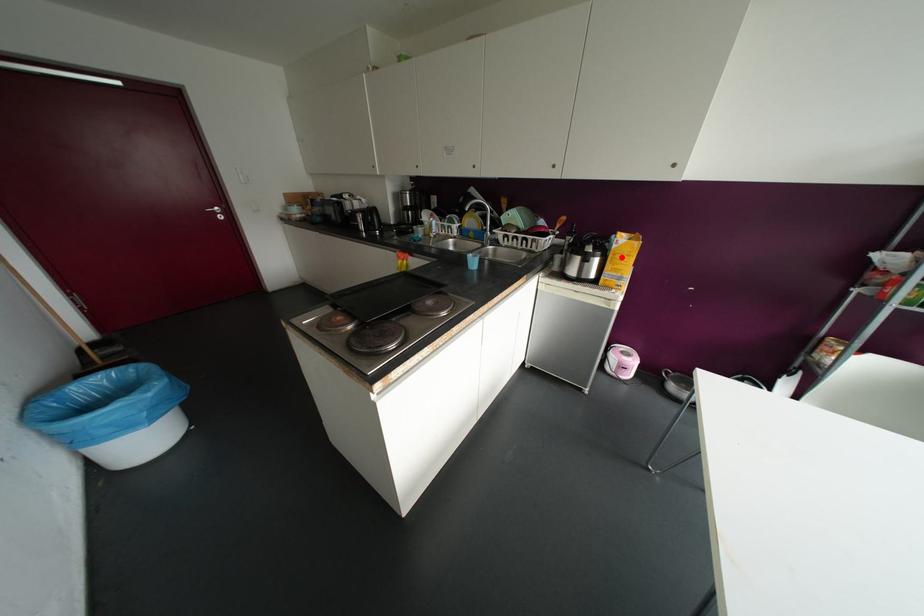
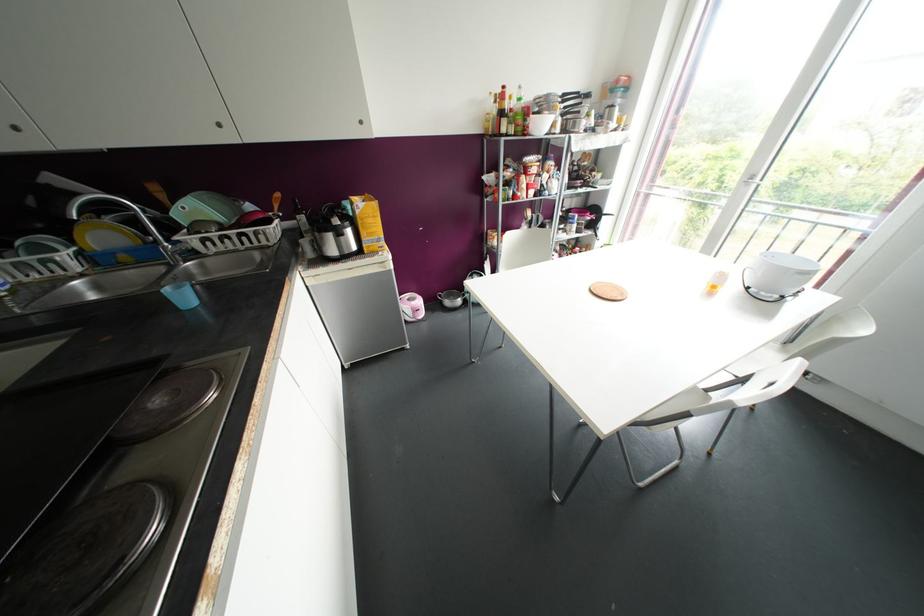
Question: I am providing you with two images of the same scene from different viewpoints. A red point is marked on the first image. Can you still see the location of the red point in image 2?

Choices:
 (A) Yes
 (B) No

Answer: (A)